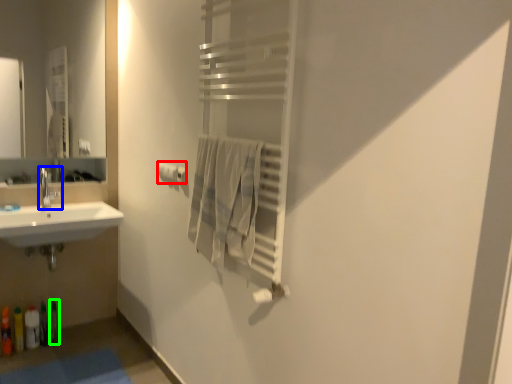
Question: Estimate the real-world distances between objects in this image. Which object is farther from toilet paper (highlighted by a red box), tap (highlighted by a blue box) or toiletry (highlighted by a green box)?

Choices:
 (A) tap
 (B) toiletry

Answer: (B)